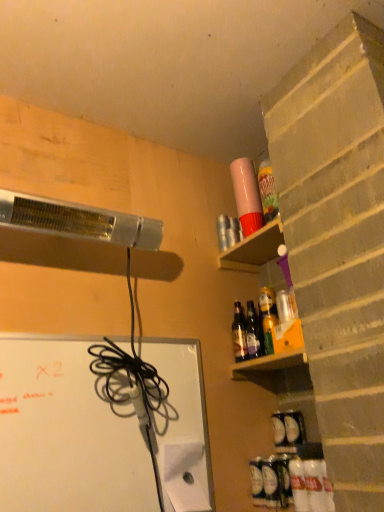
Question: From the image's perspective, does white matte bulletin board at lower left appear lower than translucent plastic bottle at lower right, the third bottle when ordered from top to bottom?

Choices:
 (A) no
 (B) yes

Answer: (A)

Question: Is translucent plastic bottle at lower right, placed as the 1th bottle when sorted from bottom to top, inside white matte bulletin board at lower left?

Choices:
 (A) yes
 (B) no

Answer: (B)

Question: Is white matte bulletin board at lower left positioned beyond the bounds of translucent plastic bottle at lower right, which ranks as the first bottle in front-to-back order?

Choices:
 (A) yes
 (B) no

Answer: (A)

Question: From a real-world perspective, is white matte bulletin board at lower left under translucent plastic bottle at lower right, placed as the 1th bottle when sorted from bottom to top?

Choices:
 (A) yes
 (B) no

Answer: (B)

Question: Is white matte bulletin board at lower left wider than translucent plastic bottle at lower right, the third bottle when ordered from top to bottom?

Choices:
 (A) yes
 (B) no

Answer: (B)

Question: Does white matte bulletin board at lower left lie in front of translucent plastic bottle at lower right, placed as the 1th bottle when sorted from bottom to top?

Choices:
 (A) no
 (B) yes

Answer: (B)

Question: From the image's perspective, does translucent glass bottles at shelf right, which is the 2th bottle from back to front, appear lower than translucent plastic bottle at lower right, the third bottle when ordered from top to bottom?

Choices:
 (A) yes
 (B) no

Answer: (B)

Question: Can you confirm if translucent glass bottles at shelf right, marked as the third bottle in a bottom-to-top arrangement, is shorter than translucent plastic bottle at lower right, placed as the 1th bottle when sorted from bottom to top?

Choices:
 (A) no
 (B) yes

Answer: (A)

Question: Is translucent glass bottles at shelf right, the second bottle positioned from the front, oriented away from translucent plastic bottle at lower right, the third bottle when ordered from top to bottom?

Choices:
 (A) yes
 (B) no

Answer: (B)

Question: From the image's perspective, is translucent glass bottles at shelf right, which is the 2th bottle from back to front, over translucent plastic bottle at lower right, the third bottle when ordered from top to bottom?

Choices:
 (A) no
 (B) yes

Answer: (B)

Question: Could translucent plastic bottle at lower right, the 3th bottle in the back-to-front sequence, be considered to be inside translucent glass bottles at shelf right, marked as the third bottle in a bottom-to-top arrangement?

Choices:
 (A) yes
 (B) no

Answer: (B)

Question: Can you confirm if translucent glass bottles at shelf right, marked as the third bottle in a bottom-to-top arrangement, is positioned to the left of translucent plastic bottle at lower right, the 3th bottle in the back-to-front sequence?

Choices:
 (A) no
 (B) yes

Answer: (B)

Question: Is purple plastic cup at upper right facing away from shiny brown glass bottles at upper right, acting as the third bottle starting from the front?

Choices:
 (A) yes
 (B) no

Answer: (B)